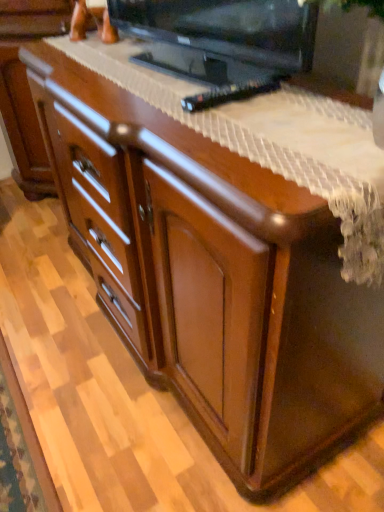
Locate an element on the screen. The width and height of the screenshot is (384, 512). free space behind black plastic remote at center is located at coordinates (197, 80).